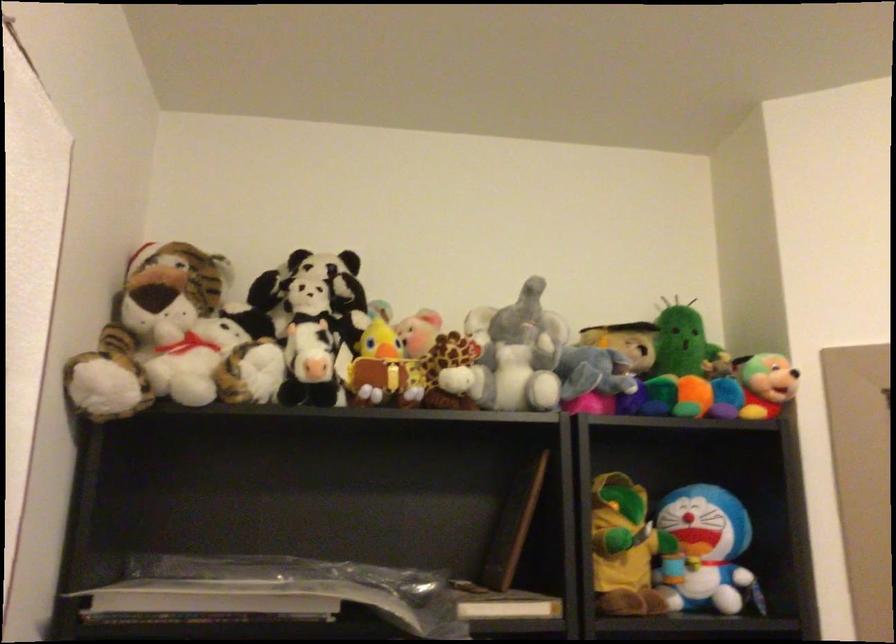
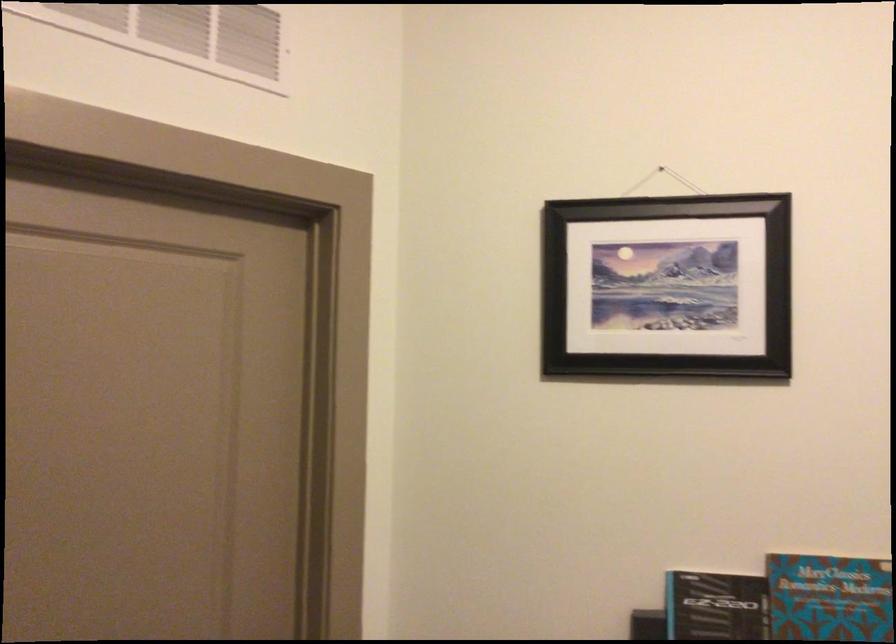
Question: The first image is from the beginning of the video and the second image is from the end. How did the camera likely rotate when shooting the video?

Choices:
 (A) Left
 (B) Right
 (C) Up
 (D) Down

Answer: (B)